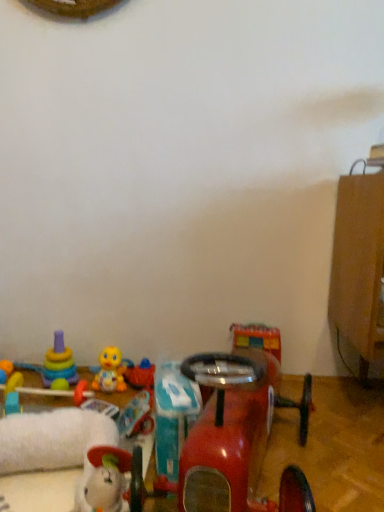
Question: Visually, is matte yellow toy at lower left, the seventh toy from the right, positioned to the left or to the right of teal plastic toy at center, marked as the 2th toy in a right-to-left arrangement?

Choices:
 (A) left
 (B) right

Answer: (A)

Question: Is point (3, 371) closer or farther from the camera than point (165, 465)?

Choices:
 (A) closer
 (B) farther

Answer: (B)

Question: Based on their relative distances, which object is nearer to the rubber duck at center, which appears as the 5th toy when viewed from the left?

Choices:
 (A) yellow rubber duck at center, positioned as the 4th toy in right-to-left order
 (B) glossy plastic toy car at lower center, marked as the first toy in a right-to-left arrangement
 (C) white plush toy at lower left, which is counted as the 5th toy, starting from the right
 (D) matte yellow toy at lower left, the seventh toy from the right
 (E) stacked plastic rings at lower left, placed as the 2th toy when sorted from left to right

Answer: (A)

Question: Which object is the closest to the yellow rubber duck at center, placed as the fourth toy when sorted from left to right?

Choices:
 (A) matte yellow toy at lower left, the seventh toy from the right
 (B) stacked plastic rings at lower left, marked as the sixth toy in a right-to-left arrangement
 (C) rubber duck at center, arranged as the 3th toy when viewed from the right
 (D) white plush toy at lower left, which is the third toy from left to right
 (E) teal plastic toy at center, the 6th toy from the left

Answer: (C)